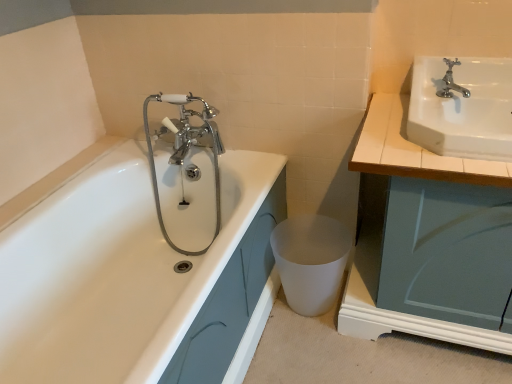
The height and width of the screenshot is (384, 512). What do you see at coordinates (310, 261) in the screenshot? I see `white matte toilet bowl at lower center` at bounding box center [310, 261].

Image resolution: width=512 pixels, height=384 pixels. Identify the location of polished chrome faucet at upper right. (451, 82).

Is polished chrome faucet at upper right in contact with white matte toilet bowl at lower center?

They are not placed beside each other.

From a real-world perspective, does polished chrome faucet at upper right stand above white matte toilet bowl at lower center?

Yes, from a real-world perspective, polished chrome faucet at upper right is above white matte toilet bowl at lower center.

Considering the relative positions of polished chrome faucet at upper right and white matte toilet bowl at lower center in the image provided, is polished chrome faucet at upper right to the left of white matte toilet bowl at lower center from the viewer's perspective?

Incorrect, polished chrome faucet at upper right is not on the left side of white matte toilet bowl at lower center.

Choose the correct answer: Is polished chrome faucet at upper right inside white matte toilet bowl at lower center or outside it?

polished chrome faucet at upper right is spatially situated outside white matte toilet bowl at lower center.

Between point (487, 96) and point (140, 237), which one is positioned in front?

The point (487, 96) is in front.

From a real-world perspective, is white glossy sink at upper right on white glossy bathtub at left?

Yes, from a real-world perspective, white glossy sink at upper right is above white glossy bathtub at left.

In the scene shown: Considering the relative sizes of white glossy sink at upper right and white glossy bathtub at left in the image provided, is white glossy sink at upper right wider than white glossy bathtub at left?

No, white glossy sink at upper right is not wider than white glossy bathtub at left.

How much distance is there between white glossy sink at upper right and white glossy bathtub at left?

white glossy sink at upper right is 33.12 inches away from white glossy bathtub at left.

Considering the relative positions of white matte toilet bowl at lower center and white glossy cabinet at right in the image provided, is white matte toilet bowl at lower center in front of white glossy cabinet at right?

That is False.

Is point (287, 272) positioned before point (377, 143)?

No, (287, 272) is further to viewer.

Is white matte toilet bowl at lower center located outside white glossy cabinet at right?

Absolutely, white matte toilet bowl at lower center is external to white glossy cabinet at right.

From the image's perspective, which one is positioned higher, white matte toilet bowl at lower center or white glossy cabinet at right?

white glossy cabinet at right is shown above in the image.

Which is in front, white matte toilet bowl at lower center or white glossy sink at upper right?

white glossy sink at upper right is more forward.

Which of these two, white matte toilet bowl at lower center or white glossy sink at upper right, stands taller?

A: With more height is white matte toilet bowl at lower center.

Is white matte toilet bowl at lower center wider than white glossy sink at upper right?

In fact, white matte toilet bowl at lower center might be narrower than white glossy sink at upper right.

Based on the photo, are white matte toilet bowl at lower center and white glossy sink at upper right far apart?

white matte toilet bowl at lower center is actually quite close to white glossy sink at upper right.

Is white glossy bathtub at left positioned far away from white matte toilet bowl at lower center?

Actually, white glossy bathtub at left and white matte toilet bowl at lower center are a little close together.

Choose the correct answer: Is white glossy bathtub at left inside white matte toilet bowl at lower center or outside it?

white glossy bathtub at left is not inside white matte toilet bowl at lower center, it's outside.

From a real-world perspective, between white glossy bathtub at left and white matte toilet bowl at lower center, who is vertically lower?

white matte toilet bowl at lower center.

Which object is further away from the camera, white glossy bathtub at left or white matte toilet bowl at lower center?

white matte toilet bowl at lower center is further from the camera.

Would you say white glossy cabinet at right is to the left or to the right of white glossy sink at upper right in the picture?

white glossy cabinet at right is positioned on white glossy sink at upper right's right side.

Is white glossy cabinet at right facing towards white glossy sink at upper right?

No, white glossy cabinet at right does not turn towards white glossy sink at upper right.

From a real-world perspective, which is physically below, white glossy cabinet at right or white glossy sink at upper right?

white glossy cabinet at right.

Considering the sizes of objects white glossy cabinet at right and white glossy sink at upper right in the image provided, who is bigger, white glossy cabinet at right or white glossy sink at upper right?

With larger size is white glossy cabinet at right.

Is polished chrome faucet at upper right shorter than white glossy sink at upper right?

Yes.

Can you confirm if polished chrome faucet at upper right is bigger than white glossy sink at upper right?

Actually, polished chrome faucet at upper right might be smaller than white glossy sink at upper right.

Is white glossy sink at upper right surrounded by polished chrome faucet at upper right?

Definitely not — white glossy sink at upper right is not inside polished chrome faucet at upper right.

Locate an element on the screen. The width and height of the screenshot is (512, 384). toilet bowl below the polished chrome faucet at upper right (from the image's perspective) is located at coordinates (310, 261).

Locate an element on the screen. sink lying on the right of white glossy bathtub at left is located at coordinates pyautogui.click(x=462, y=107).

Based on their spatial positions, is polished chrome faucet at upper right or white matte toilet bowl at lower center further from white glossy cabinet at right?

The object further to white glossy cabinet at right is white matte toilet bowl at lower center.

From the picture: Considering their positions, is white matte toilet bowl at lower center positioned further to white glossy cabinet at right than white glossy bathtub at left?

white glossy bathtub at left is further to white glossy cabinet at right.

From the image, which object appears to be nearer to white glossy bathtub at left, white matte toilet bowl at lower center or white glossy sink at upper right?

The object closer to white glossy bathtub at left is white matte toilet bowl at lower center.

Based on their spatial positions, is white matte toilet bowl at lower center or white glossy cabinet at right closer to polished chrome faucet at upper right?

Among the two, white glossy cabinet at right is located nearer to polished chrome faucet at upper right.

Based on the photo, estimate the real-world distances between objects in this image. Which object is further from white glossy sink at upper right, white glossy bathtub at left or white matte toilet bowl at lower center?

Among the two, white glossy bathtub at left is located further to white glossy sink at upper right.

From the image, which object appears to be nearer to white glossy sink at upper right, white matte toilet bowl at lower center or white glossy bathtub at left?

white matte toilet bowl at lower center lies closer to white glossy sink at upper right than the other object.

When comparing their distances from white glossy sink at upper right, does white glossy bathtub at left or polished chrome faucet at upper right seem closer?

Among the two, polished chrome faucet at upper right is located nearer to white glossy sink at upper right.

Which object lies further to the anchor point white glossy sink at upper right, white glossy bathtub at left or white glossy cabinet at right?

white glossy bathtub at left.

Identify the location of toilet bowl between white glossy bathtub at left and white glossy sink at upper right. Image resolution: width=512 pixels, height=384 pixels. (310, 261).

At what (x,y) coordinates should I click in order to perform the action: click on toilet bowl between white glossy bathtub at left and white glossy cabinet at right in the horizontal direction. Please return your answer as a coordinate pair (x, y). This screenshot has width=512, height=384. Looking at the image, I should click on (310, 261).

Find the location of a particular element. Image resolution: width=512 pixels, height=384 pixels. sink between polished chrome faucet at upper right and white glossy cabinet at right vertically is located at coordinates (462, 107).

You are a GUI agent. You are given a task and a screenshot of the screen. Output one action in this format:
    pyautogui.click(x=<x>, y=<y>)
    Task: Click on the tap between white glossy bathtub at left and white glossy cabinet at right from left to right
    Image resolution: width=512 pixels, height=384 pixels.
    Given the screenshot: What is the action you would take?
    pyautogui.click(x=451, y=82)